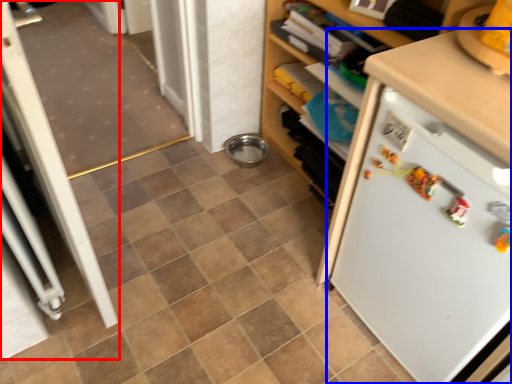
Question: Which of the following is the closest to the observer, screen door (highlighted by a red box) or refrigerator (highlighted by a blue box)?

Choices:
 (A) screen door
 (B) refrigerator

Answer: (B)